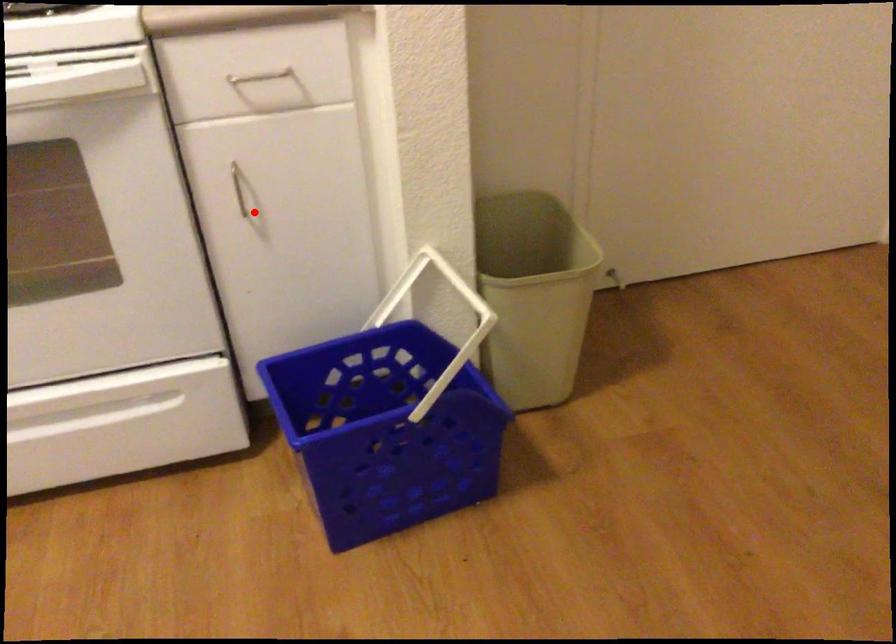
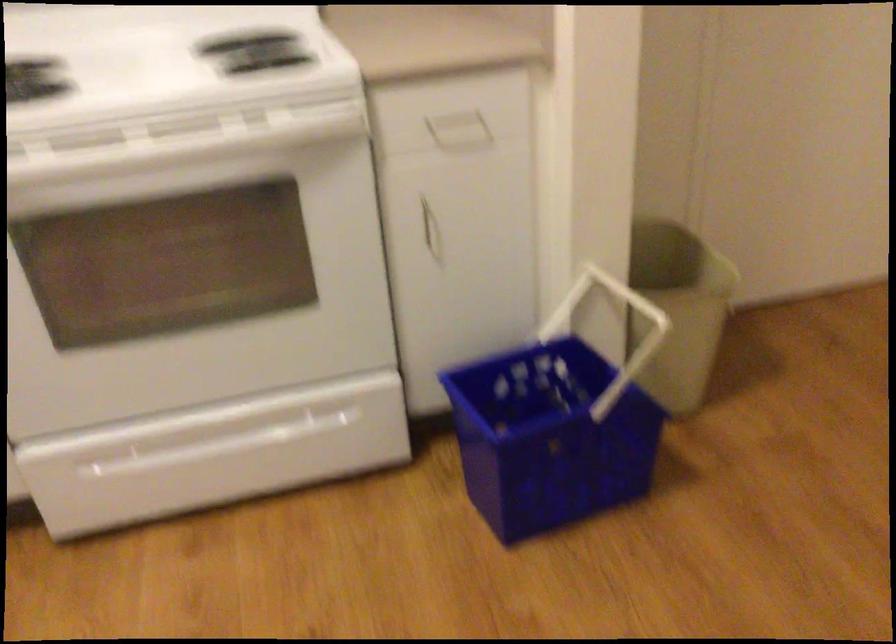
The point at the highlighted location is marked in the first image. Where is the corresponding point in the second image?

(431, 234)